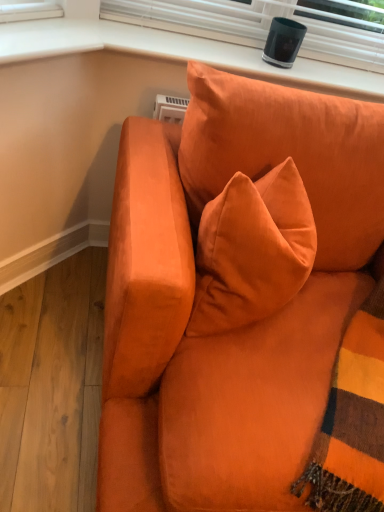
Question: From a real-world perspective, is matte orange couch at center physically located above or below matte black speaker at upper center?

Choices:
 (A) below
 (B) above

Answer: (A)

Question: In terms of size, does matte orange couch at center appear bigger or smaller than matte black speaker at upper center?

Choices:
 (A) big
 (B) small

Answer: (A)

Question: Considering their positions, is matte orange couch at center located in front of or behind matte black speaker at upper center?

Choices:
 (A) front
 (B) behind

Answer: (A)

Question: Do you think matte black speaker at upper center is within matte orange couch at center, or outside of it?

Choices:
 (A) outside
 (B) inside

Answer: (A)

Question: Relative to matte orange couch at center, is matte black speaker at upper center in front or behind?

Choices:
 (A) front
 (B) behind

Answer: (B)

Question: Visually, is matte black speaker at upper center positioned to the left or to the right of matte orange couch at center?

Choices:
 (A) right
 (B) left

Answer: (B)

Question: Considering the positions of matte black speaker at upper center and matte orange couch at center in the image, is matte black speaker at upper center wider or thinner than matte orange couch at center?

Choices:
 (A) wide
 (B) thin

Answer: (B)